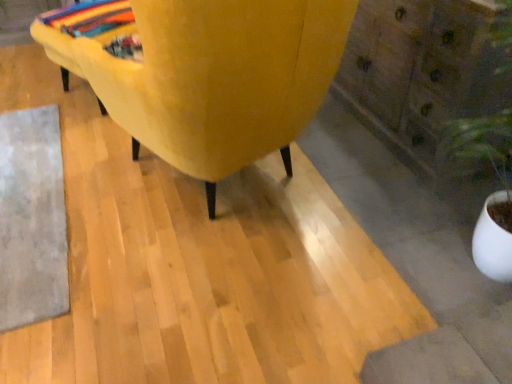
I want to click on free space between velvet yellow chair at center and gray woolen mat at lower left, so click(x=116, y=206).